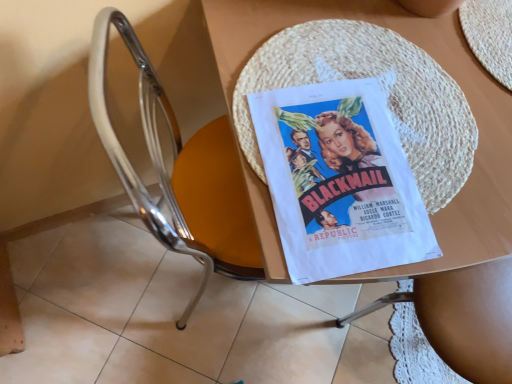
The height and width of the screenshot is (384, 512). Find the location of `free location to the right of white paper poster at center`. free location to the right of white paper poster at center is located at coordinates click(x=461, y=176).